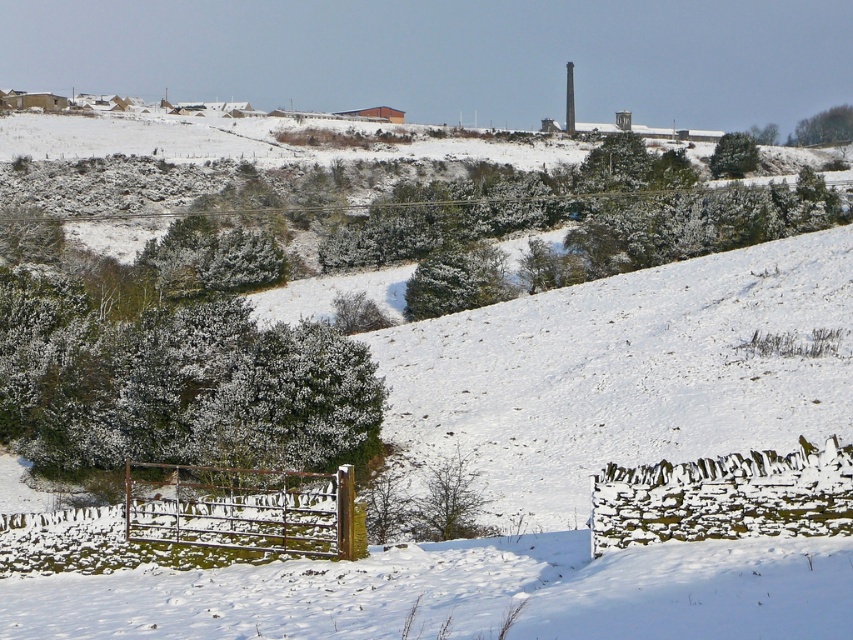
You are an artist planning to paint the winter landscape. You want to ensure the green leafy tree at upper right and the green matte tree at upper right are proportionally accurate. Which tree should you paint smaller?

The green leafy tree at upper right should be painted smaller because it has a smaller size compared to the green matte tree at upper right.

You are an artist sketching the winter landscape and want to ensure the proportions between the green textured bush at left and the green matte tree at upper right are accurate. Which one should you draw as taller?

The green textured bush at left is shorter than the green matte tree at upper right, so you should draw the green matte tree at upper right as taller.